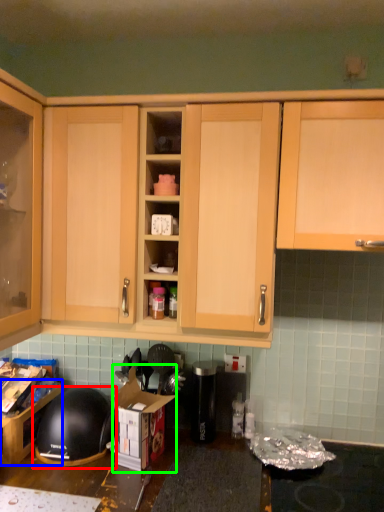
Question: Considering the real-world distances, which object is closest to helmet (highlighted by a red box)? cabinetry (highlighted by a blue box) or cardboard box (highlighted by a green box).

Choices:
 (A) cabinetry
 (B) cardboard box

Answer: (A)